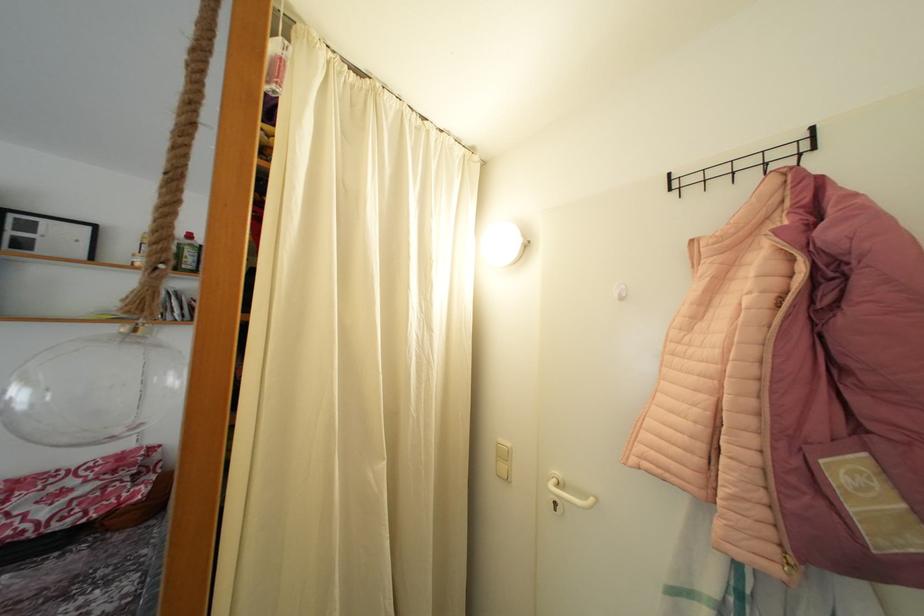
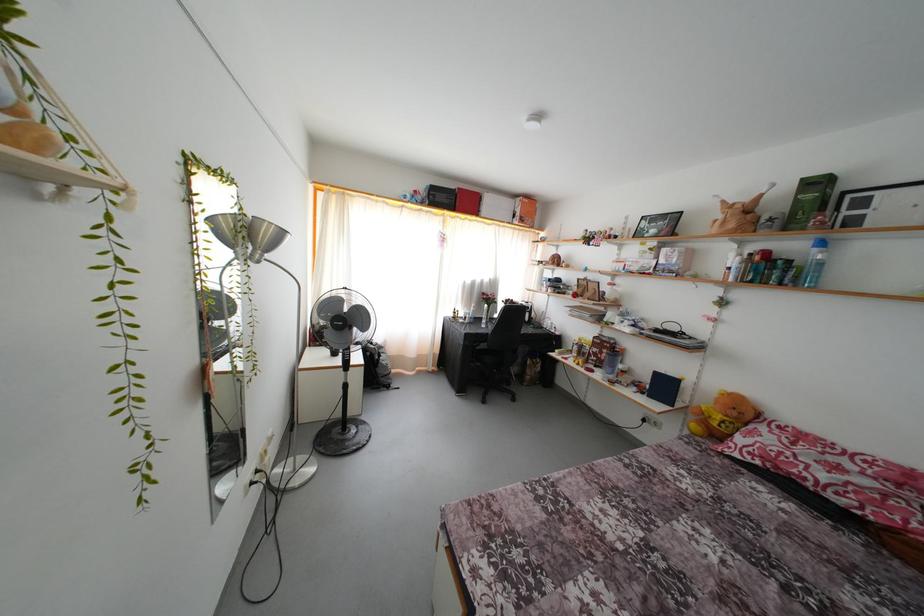
Question: The images are taken continuously from a first-person perspective. In which direction is your viewpoint rotating?

Choices:
 (A) Left
 (B) Right
 (C) Up
 (D) Down

Answer: (A)